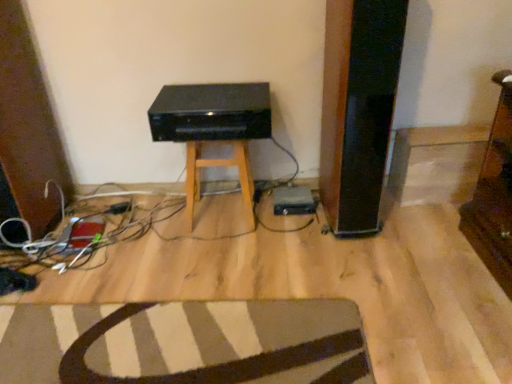
Where is `vacant area on the back side of black plastic plug at lower left`? This screenshot has width=512, height=384. vacant area on the back side of black plastic plug at lower left is located at coordinates (124, 195).